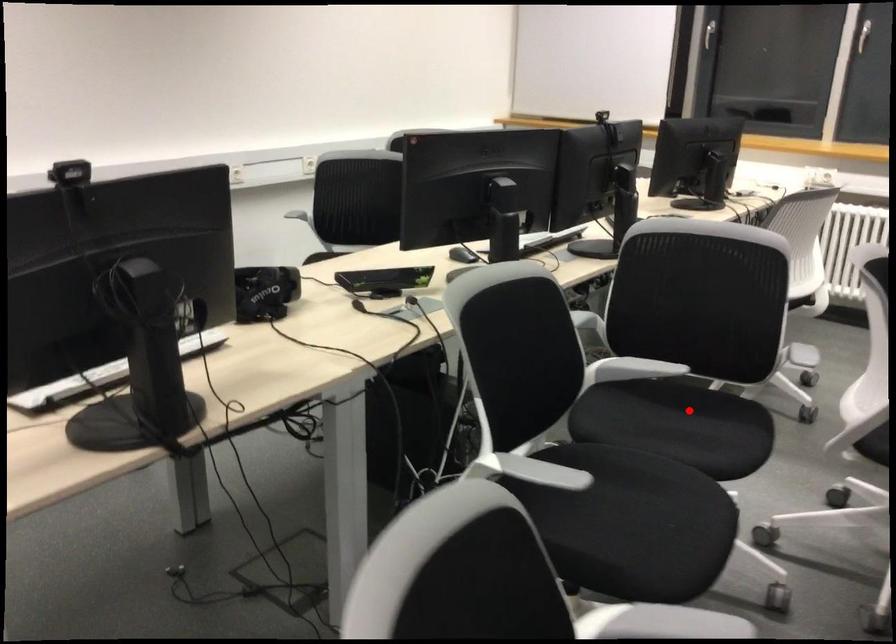
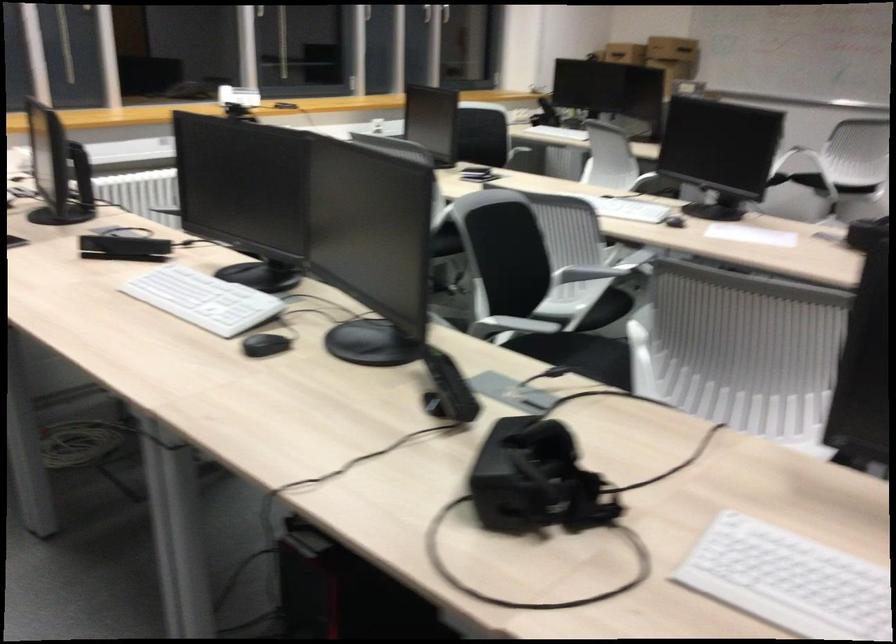
In the second image, find the point that corresponds to the highlighted location in the first image.

(579, 355)